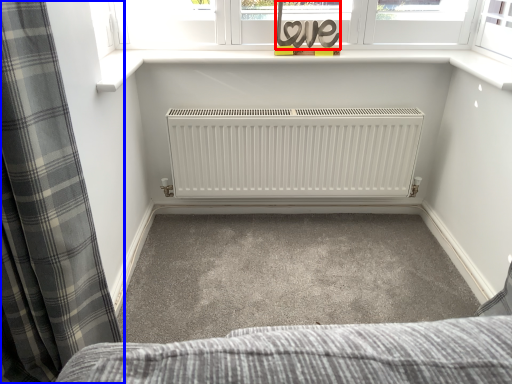
Question: Which point is closer to the camera, writing (highlighted by a red box) or curtain (highlighted by a blue box)?

Choices:
 (A) writing
 (B) curtain

Answer: (B)